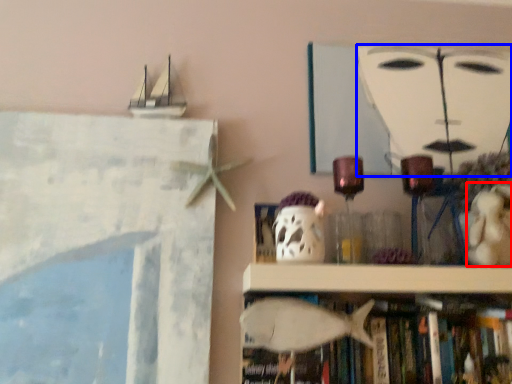
Question: Which object is closer to the camera taking this photo, toy (highlighted by a red box) or human face (highlighted by a blue box)?

Choices:
 (A) toy
 (B) human face

Answer: (A)